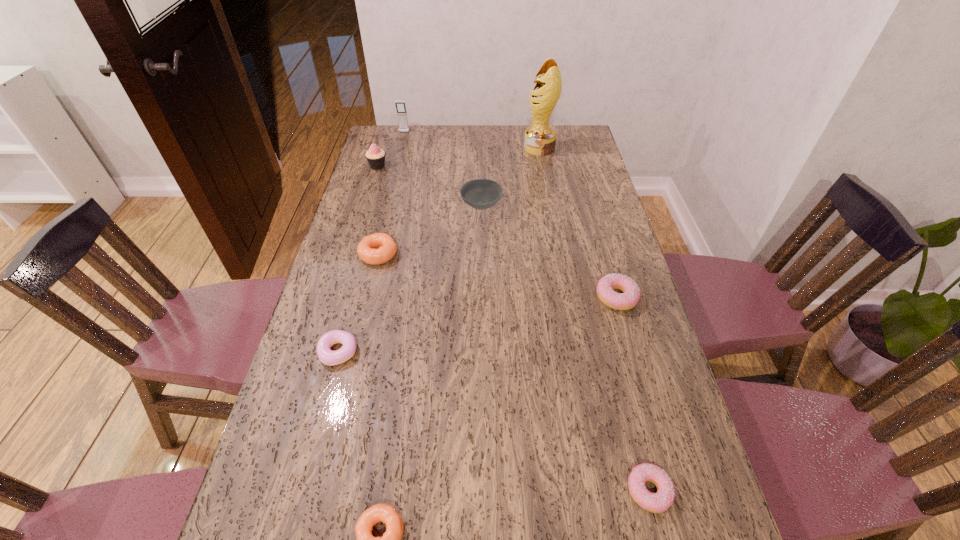
Find the location of a particular element. Image resolution: width=960 pixels, height=540 pixels. the tallest object is located at coordinates (540, 138).

Locate an element on the screen. the eighth nearest object is located at coordinates (540, 138).

Where is `cellular telephone`? This screenshot has height=540, width=960. cellular telephone is located at coordinates (400, 105).

The image size is (960, 540). I want to click on the second tallest object, so click(400, 105).

I want to click on cupcake, so click(375, 156).

At what (x,y) coordinates should I click in order to perform the action: click on the third farthest object. Please return your answer as a coordinate pair (x, y). This screenshot has width=960, height=540. Looking at the image, I should click on pyautogui.click(x=375, y=156).

What are the coordinates of `the fourth tallest object` in the screenshot? It's located at (480, 194).

The image size is (960, 540). Find the location of `bowl`. bowl is located at coordinates (480, 194).

Locate an element on the screen. the farthest doughnut is located at coordinates (385, 247).

This screenshot has height=540, width=960. I want to click on the farther tan doughnut, so coord(385,247).